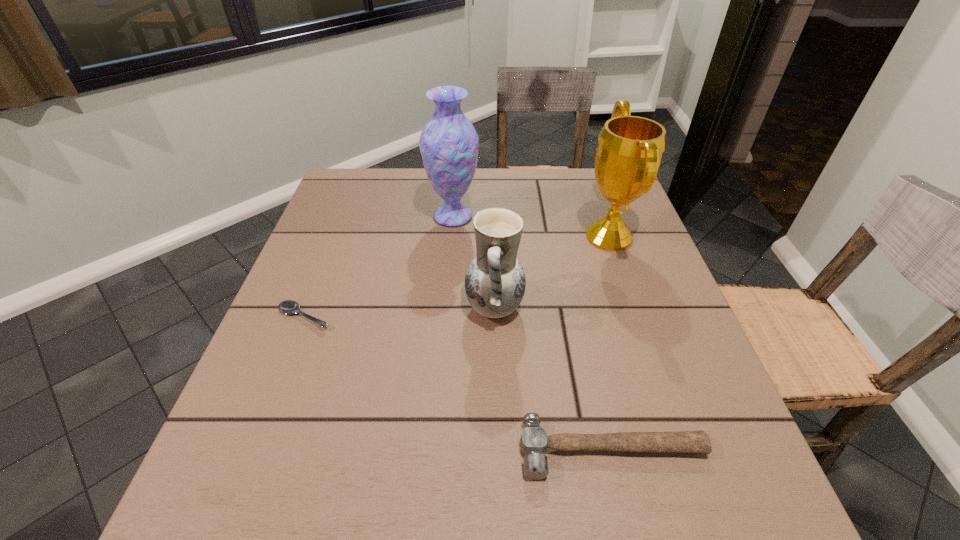
I want to click on hammer that is at the right edge, so click(x=534, y=441).

This screenshot has height=540, width=960. I want to click on object at the far right corner, so (x=630, y=149).

You are a GUI agent. You are given a task and a screenshot of the screen. Output one action in this format:
    pyautogui.click(x=<x>, y=<y>)
    Task: Click on the object present at the near right corner
    
    Given the screenshot: What is the action you would take?
    pyautogui.click(x=534, y=441)

In the image, there is a desktop. At what (x,y) coordinates should I click in order to perform the action: click on free region at the far edge. Please return your answer as a coordinate pair (x, y). Looking at the image, I should click on (561, 186).

Image resolution: width=960 pixels, height=540 pixels. In the image, there is a desktop. What are the coordinates of `vacant space at the near edge` in the screenshot? It's located at (391, 505).

Where is `free space at the left edge of the desktop`? free space at the left edge of the desktop is located at coordinates (264, 410).

Image resolution: width=960 pixels, height=540 pixels. In the image, there is a desktop. Identify the location of vacant space at the right edge. pyautogui.click(x=645, y=314).

In the image, there is a desktop. Where is `free space at the far left corner`? This screenshot has width=960, height=540. free space at the far left corner is located at coordinates (392, 180).

Where is `free space at the near left corner`? free space at the near left corner is located at coordinates (296, 503).

Where is `blank space at the far right corner of the desktop`? The height and width of the screenshot is (540, 960). blank space at the far right corner of the desktop is located at coordinates (575, 187).